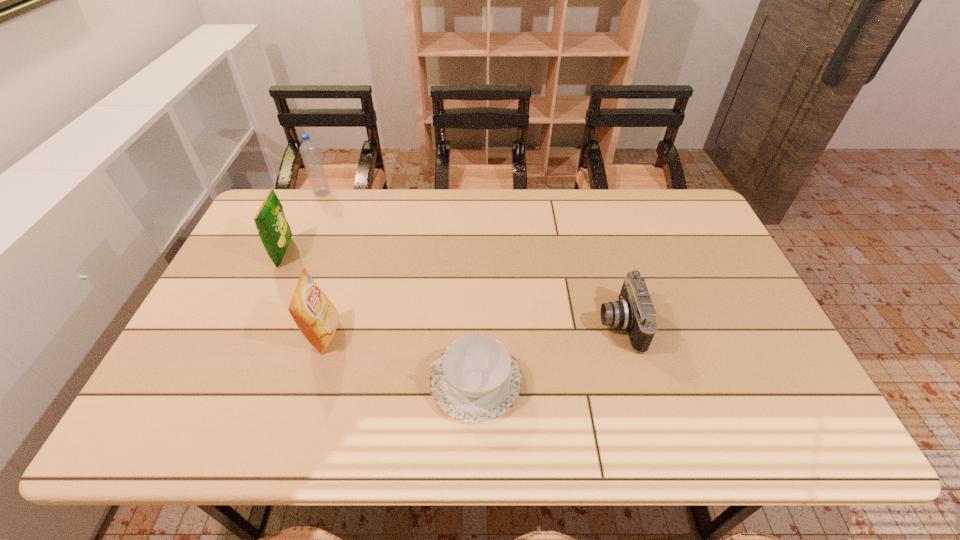
What are the coordinates of `vacant area situated 0.230m on the front-facing side of the left crisp (potato chip)` in the screenshot? It's located at [x=368, y=253].

Where is `vacant space located on the front-facing side of the right crisp (potato chip)`? The width and height of the screenshot is (960, 540). vacant space located on the front-facing side of the right crisp (potato chip) is located at coordinates (420, 334).

Where is `free spot located on the front-facing side of the rightmost object`? Image resolution: width=960 pixels, height=540 pixels. free spot located on the front-facing side of the rightmost object is located at coordinates (539, 324).

I want to click on free point located on the front-facing side of the rightmost object, so click(x=486, y=324).

Find the location of a particular element. The image size is (960, 540). vacant space located on the front-facing side of the rightmost object is located at coordinates (527, 324).

Where is `vacant space located 0.230m on the handle side of the second object from right to left`? vacant space located 0.230m on the handle side of the second object from right to left is located at coordinates (333, 382).

The image size is (960, 540). Find the location of `free space located 0.380m on the handle side of the second object from right to left`. free space located 0.380m on the handle side of the second object from right to left is located at coordinates (270, 382).

At what (x,y) coordinates should I click in order to perform the action: click on free region located on the handle side of the second object from right to left. Please return your answer as a coordinate pair (x, y). The image size is (960, 540). Looking at the image, I should click on (346, 382).

Identify the location of object that is at the far edge. (309, 150).

Where is `object situated at the near edge`? The height and width of the screenshot is (540, 960). object situated at the near edge is located at coordinates (476, 379).